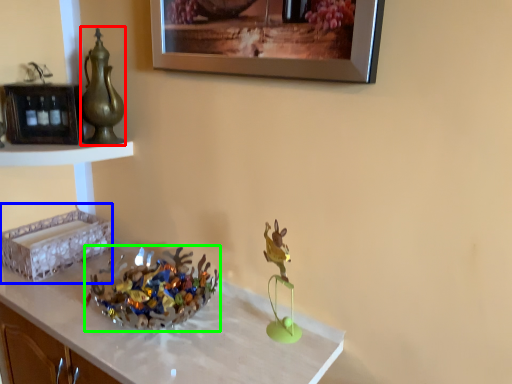
Question: Which object is the closest to the tea pot (highlighted by a red box)? Choose among these: shelf (highlighted by a blue box) or floral arrangement (highlighted by a green box).

Choices:
 (A) shelf
 (B) floral arrangement

Answer: (A)